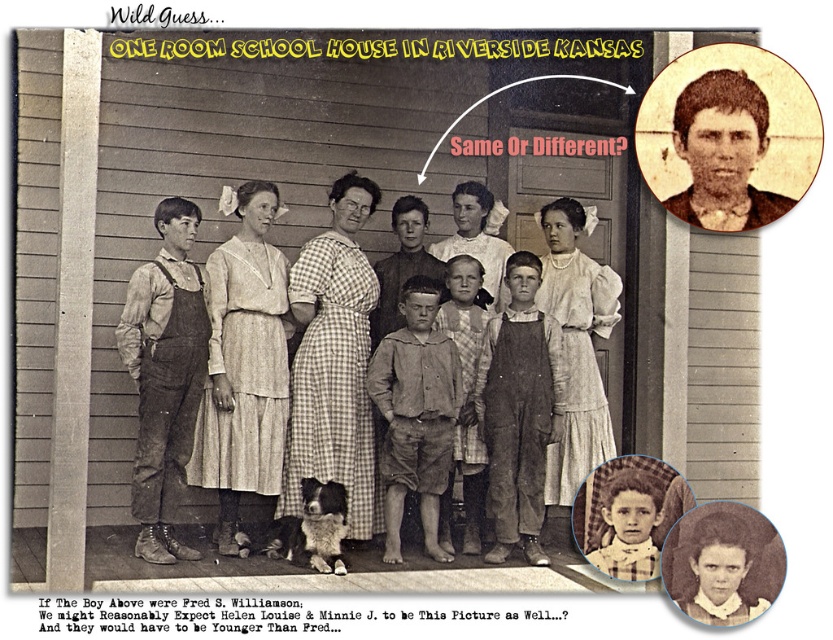
Which is above, light brown hair at center or matte white dress at center?

light brown hair at center is above.

Is point (637, 508) farther from viewer compared to point (699, 538)?

That is True.

Identify the location of light brown hair at center. (626, 524).

From the picture: Who is taller, light beige cotton dress at center or smooth wooden boy at center?

light beige cotton dress at center is taller.

Does light beige cotton dress at center have a lesser height compared to smooth wooden boy at center?

No, light beige cotton dress at center is not shorter than smooth wooden boy at center.

Who is more distant from viewer, (602,330) or (440,272)?

Positioned behind is point (440,272).

The height and width of the screenshot is (640, 833). Find the location of `light beige cotton dress at center`. light beige cotton dress at center is located at coordinates (576, 346).

Does light brown cotton shirt at center appear on the right side of matte white dress at center?

Incorrect, light brown cotton shirt at center is not on the right side of matte white dress at center.

Who is taller, light brown cotton shirt at center or matte white dress at center?

light brown cotton shirt at center

Is point (415, 420) behind point (706, 547)?

Yes.

Locate an element on the screen. The image size is (833, 640). light brown cotton shirt at center is located at coordinates (415, 413).